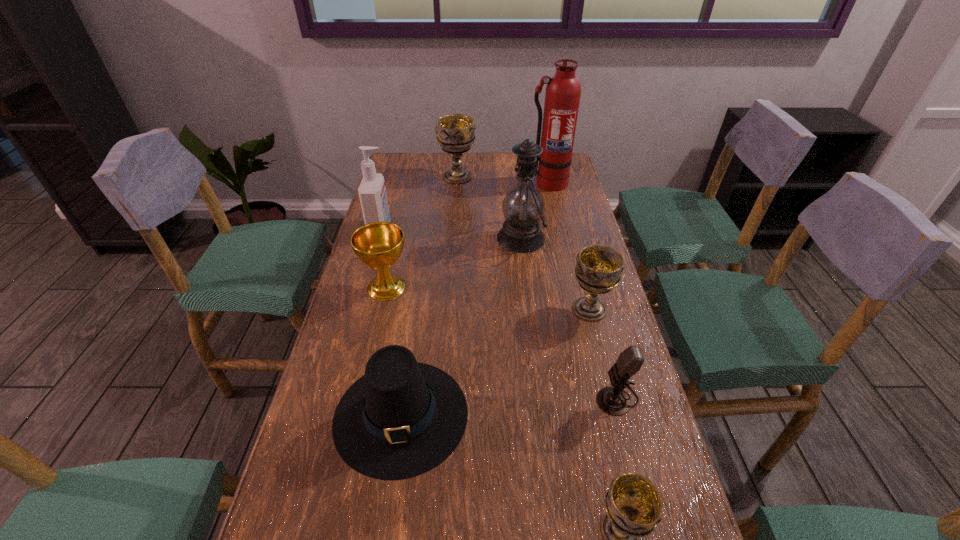
The width and height of the screenshot is (960, 540). I want to click on the tallest object, so point(563,91).

Find the location of a particular element. Image resolution: width=960 pixels, height=540 pixels. gray oil lamp is located at coordinates (523, 207).

Find the location of a particular element. This screenshot has width=960, height=540. cleansing agent is located at coordinates (372, 192).

Image resolution: width=960 pixels, height=540 pixels. I want to click on the third chalice from right to left, so click(455, 133).

Where is `the farthest chalice`? This screenshot has height=540, width=960. the farthest chalice is located at coordinates tap(455, 133).

At what (x,y) coordinates should I click in order to perform the action: click on the leftmost chalice. Please return your answer as a coordinate pair (x, y). This screenshot has height=540, width=960. Looking at the image, I should click on (378, 245).

Find the location of a particular element. the second smallest white chalice is located at coordinates (599, 268).

Find the location of a particular element. microphone is located at coordinates (613, 400).

At what (x,y) coordinates should I click in order to perform the action: click on gray hat. Please return your answer as a coordinate pair (x, y). Image resolution: width=960 pixels, height=540 pixels. Looking at the image, I should click on (403, 418).

Find the location of `free space located 0.110m on the label side of the fire extinguisher`. free space located 0.110m on the label side of the fire extinguisher is located at coordinates (553, 208).